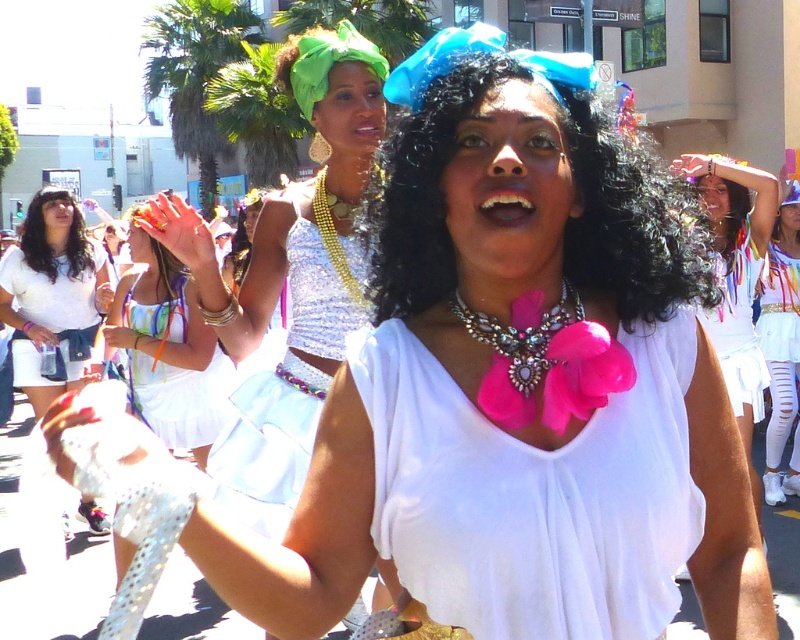
Based on the scene description, which object is larger in size between the pink satin bow at center and the white satin skirt at lower right?

The pink satin bow at center is larger in size compared to the white satin skirt at lower right according to the description.

You are a photographer trying to capture the vibrant street scene. You notice two central figures wearing a shiny silver top at center and a white cotton shirt at center. Which of these two tops is wider when viewed from your camera angle?

The shiny silver top at center is wider than the white cotton shirt at center as per the description provided.

You are a photographer at the event and want to capture a photo that includes both the pink fabric bow at center and the shiny silver top at center. Which object will appear closer to the camera in the photo?

The pink fabric bow at center will appear closer to the camera because it is in front of the shiny silver top at center.